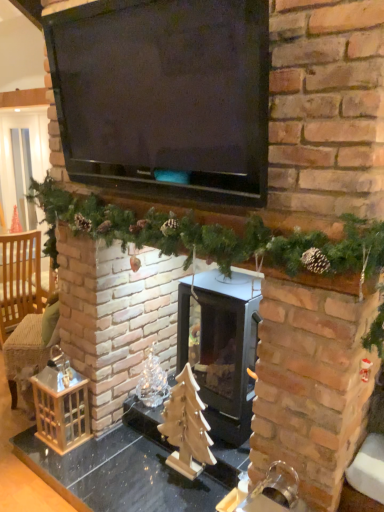
Question: Does black glass wood burning stove at center turn towards black matte television at upper center?

Choices:
 (A) no
 (B) yes

Answer: (A)

Question: Considering the relative positions of black glass wood burning stove at center and black matte television at upper center in the image provided, is black glass wood burning stove at center in front of black matte television at upper center?

Choices:
 (A) yes
 (B) no

Answer: (B)

Question: From a real-world perspective, is black glass wood burning stove at center under black matte television at upper center?

Choices:
 (A) no
 (B) yes

Answer: (B)

Question: Is black glass wood burning stove at center smaller than black matte television at upper center?

Choices:
 (A) no
 (B) yes

Answer: (B)

Question: Is black glass wood burning stove at center shorter than black matte television at upper center?

Choices:
 (A) yes
 (B) no

Answer: (B)

Question: Considering the relative positions of black glass wood burning stove at center and black matte television at upper center in the image provided, is black glass wood burning stove at center to the left of black matte television at upper center from the viewer's perspective?

Choices:
 (A) no
 (B) yes

Answer: (A)

Question: Is light brown woven armchair at left positioned with its back to wooden christmas tree at center?

Choices:
 (A) no
 (B) yes

Answer: (B)

Question: From a real-world perspective, is light brown woven armchair at left positioned under wooden christmas tree at center based on gravity?

Choices:
 (A) yes
 (B) no

Answer: (B)

Question: Considering the relative sizes of light brown woven armchair at left and wooden christmas tree at center in the image provided, is light brown woven armchair at left wider than wooden christmas tree at center?

Choices:
 (A) yes
 (B) no

Answer: (A)

Question: From the image's perspective, is light brown woven armchair at left on top of wooden christmas tree at center?

Choices:
 (A) no
 (B) yes

Answer: (B)

Question: From a real-world perspective, does light brown woven armchair at left stand above wooden christmas tree at center?

Choices:
 (A) no
 (B) yes

Answer: (B)

Question: Considering the relative sizes of light brown woven armchair at left and wooden christmas tree at center in the image provided, is light brown woven armchair at left taller than wooden christmas tree at center?

Choices:
 (A) no
 (B) yes

Answer: (B)

Question: Does light brown woven armchair at left turn towards wooden table at center?

Choices:
 (A) no
 (B) yes

Answer: (A)